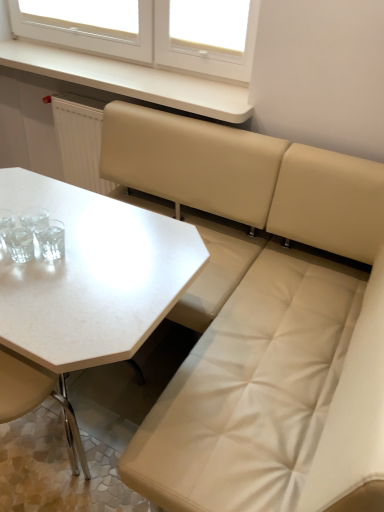
The height and width of the screenshot is (512, 384). I want to click on empty space that is ontop of white matte counter top at upper center (from a real-world perspective), so click(x=106, y=68).